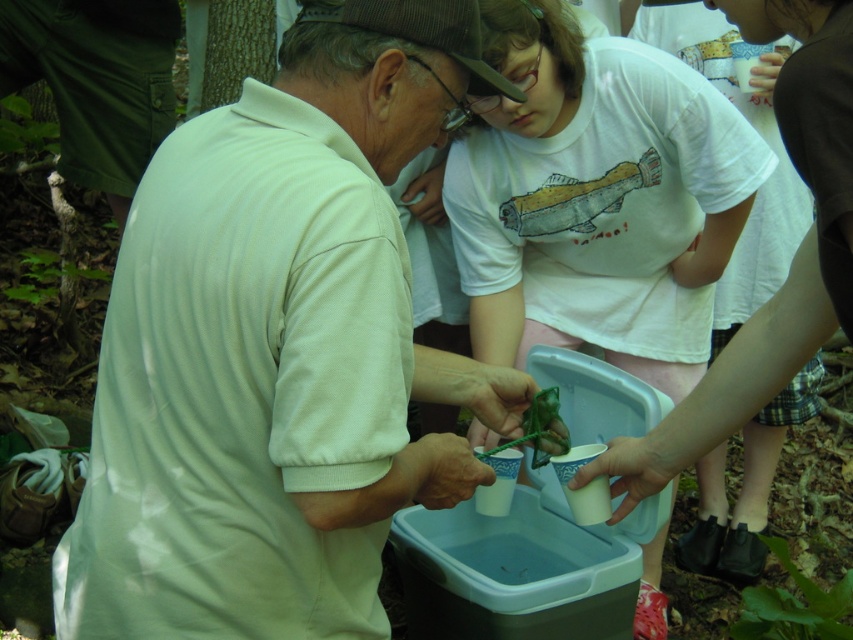
You are standing in the wooded area and see the white matte shirt at center. Can you determine its exact position using the coordinate system provided?

The white matte shirt at center is located at point [277,348] according to the coordinate system provided.

Consider the image. Where is the white matte shirt at center located in the image?

The white matte shirt at center is located at point 0.545 on the x axis and 0.326 on the y axis.